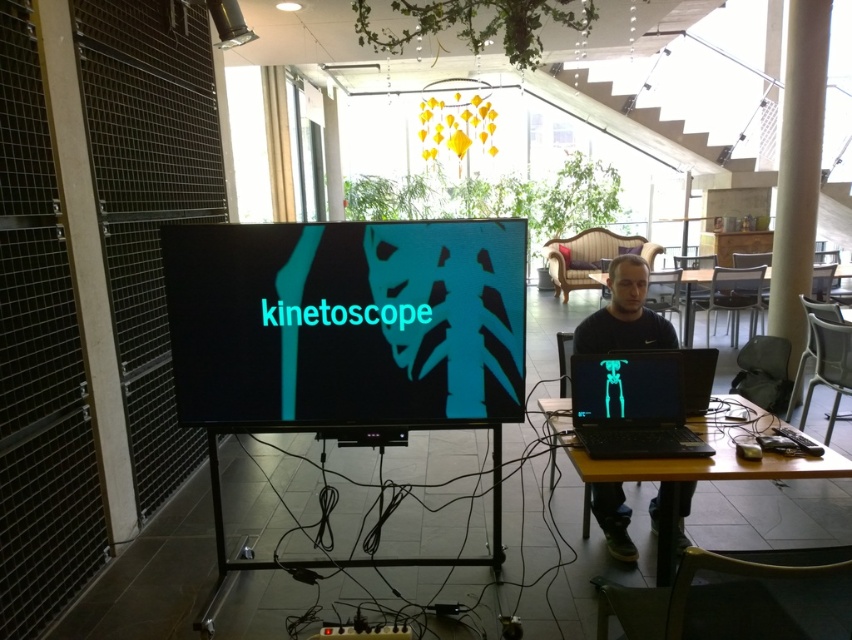
You are a delivery person who needs to place a small package between the black glossy laptop at right and the black plastic table at lower right. Can the package fit in the space between them?

The space between the black glossy laptop at right and the black plastic table at lower right is 6.14 inches. Since the package is small, it should fit comfortably in the available space.

You are a visitor in this office and need to place a small potted plant on the surface that is higher between the black plastic table at lower right and the black matte laptop at right. Which surface should you choose?

The black plastic table at lower right has a greater height compared to the black matte laptop at right, so you should place the potted plant on the black plastic table at lower right.